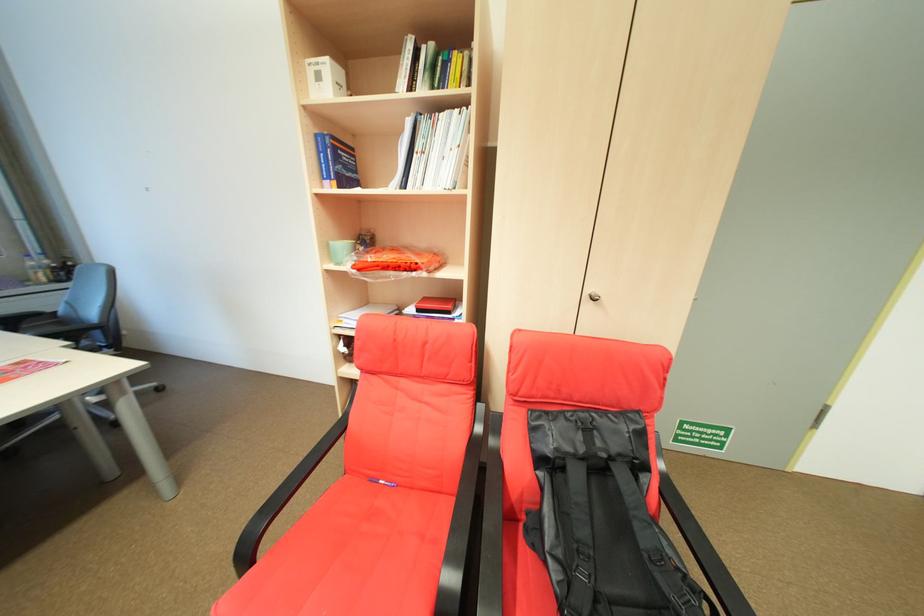
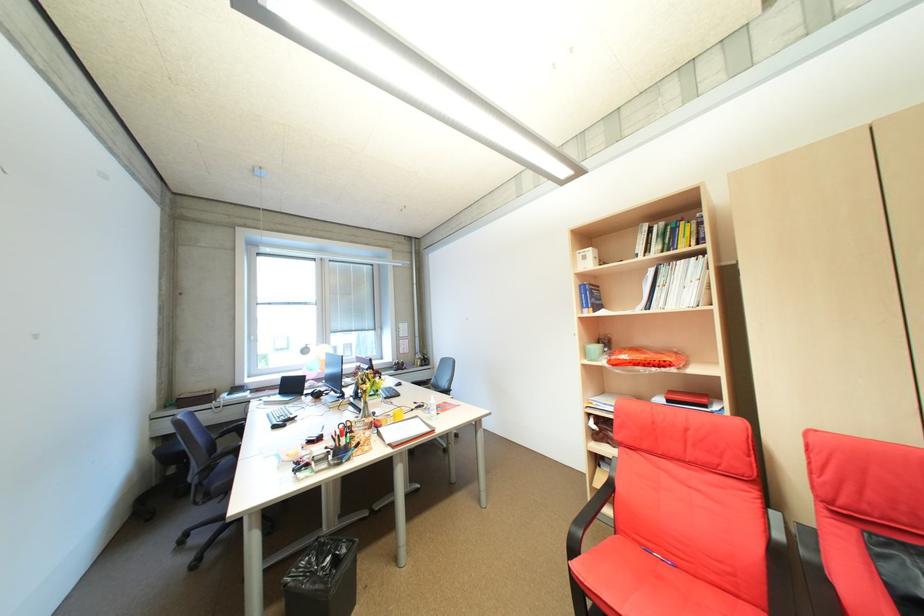
Locate, in the second image, the point that corresponds to point (354, 322) in the first image.

(603, 403)